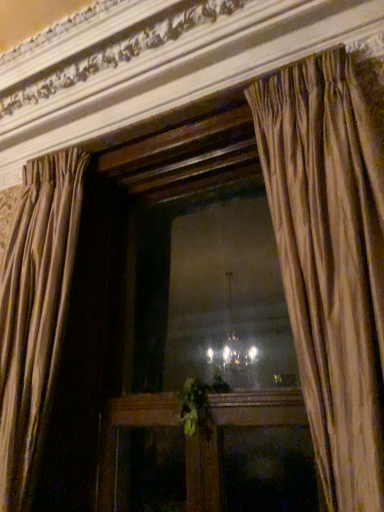
Question: Is wooden frame at center taller or shorter than silky beige curtain at center, which is the 2th curtain in left-to-right order?

Choices:
 (A) tall
 (B) short

Answer: (B)

Question: From the image's perspective, is wooden frame at center above or below silky beige curtain at center, which is the 2th curtain in left-to-right order?

Choices:
 (A) below
 (B) above

Answer: (A)

Question: Considering the real-world distances, which object is farthest from the silky beige curtain at left, the second curtain from the right?

Choices:
 (A) silky beige curtain at center, which is the 2th curtain in left-to-right order
 (B) green leafy plant at center
 (C) wooden frame at center

Answer: (A)

Question: Based on their relative distances, which object is nearer to the silky beige curtain at left, the first curtain viewed from the left?

Choices:
 (A) silky beige curtain at center, the first curtain when ordered from right to left
 (B) wooden frame at center
 (C) green leafy plant at center

Answer: (B)